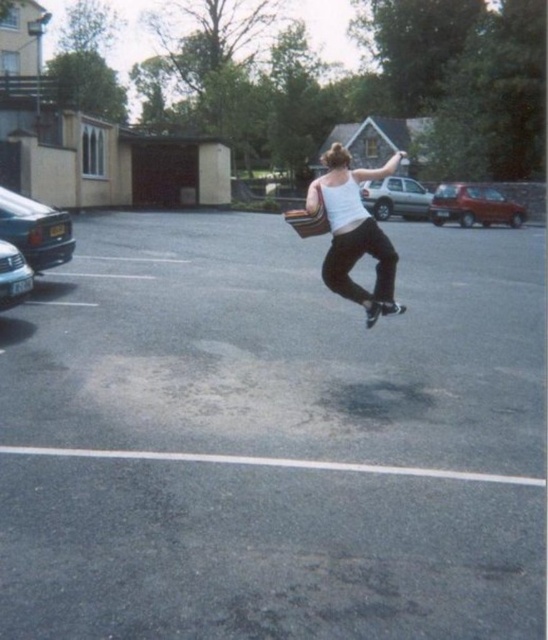
Can you confirm if asphalt at center is positioned to the right of silver metallic car at left?

Correct, you'll find asphalt at center to the right of silver metallic car at left.

Does point (85, 246) lie behind point (4, 296)?

Yes, point (85, 246) is behind point (4, 296).

Does point (315, 480) lie in front of point (20, 289)?

Yes.

Find the location of a particular element. This screenshot has width=548, height=640. asphalt at center is located at coordinates (272, 438).

Is silver metallic hatchback at center taller than silver metallic car at left?

Yes, silver metallic hatchback at center is taller than silver metallic car at left.

Which of these two, silver metallic hatchback at center or silver metallic car at left, stands shorter?

silver metallic car at left

At what (x,y) coordinates should I click in order to perform the action: click on silver metallic hatchback at center. Please return your answer as a coordinate pair (x, y). This screenshot has width=548, height=640. Looking at the image, I should click on (396, 198).

Locate an element on the screen. The width and height of the screenshot is (548, 640). silver metallic hatchback at center is located at coordinates (396, 198).

Is point (335, 150) positioned in front of point (21, 276)?

Yes, it is in front of point (21, 276).

Locate an element on the screen. The image size is (548, 640). white matte tank top at center is located at coordinates (355, 232).